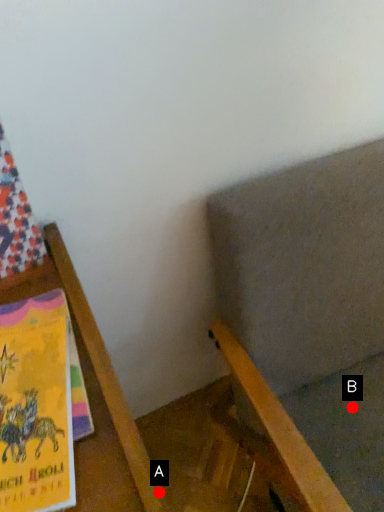
Question: Two points are circled on the image, labeled by A and B beside each circle. Which point appears closest to the camera in this image?

Choices:
 (A) A is closer
 (B) B is closer

Answer: (B)